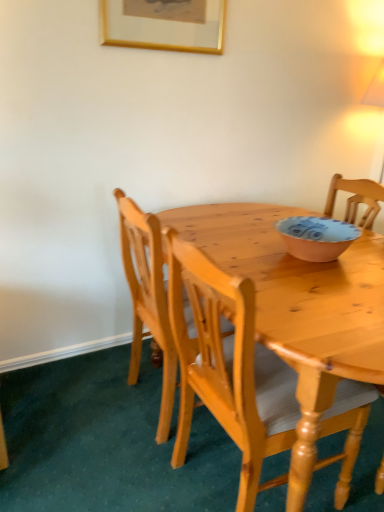
Question: Should I look upward or downward to see matte pink bowl at center?

Choices:
 (A) down
 (B) up

Answer: (B)

Question: Is matte pink bowl at center a part of gold-framed picture at upper center?

Choices:
 (A) no
 (B) yes

Answer: (A)

Question: Is gold-framed picture at upper center next to matte pink bowl at center?

Choices:
 (A) no
 (B) yes

Answer: (A)

Question: Is gold-framed picture at upper center thinner than matte pink bowl at center?

Choices:
 (A) yes
 (B) no

Answer: (A)

Question: From the image's perspective, is gold-framed picture at upper center below matte pink bowl at center?

Choices:
 (A) yes
 (B) no

Answer: (B)

Question: Is gold-framed picture at upper center facing towards matte pink bowl at center?

Choices:
 (A) yes
 (B) no

Answer: (B)

Question: Is gold-framed picture at upper center further to the viewer compared to matte pink bowl at center?

Choices:
 (A) yes
 (B) no

Answer: (A)

Question: Is matte pink bowl at center behind light brown wooden chair at center, acting as the 1th chair starting from the back?

Choices:
 (A) yes
 (B) no

Answer: (A)

Question: Is matte pink bowl at center positioned in front of light brown wooden chair at center, the second chair when ordered from front to back?

Choices:
 (A) yes
 (B) no

Answer: (B)

Question: From a real-world perspective, is matte pink bowl at center physically above light brown wooden chair at center, the second chair when ordered from front to back?

Choices:
 (A) yes
 (B) no

Answer: (A)

Question: Is matte pink bowl at center smaller than light brown wooden chair at center, the second chair when ordered from front to back?

Choices:
 (A) yes
 (B) no

Answer: (A)

Question: Would you say matte pink bowl at center is a long distance from light brown wooden chair at center, acting as the 1th chair starting from the back?

Choices:
 (A) yes
 (B) no

Answer: (B)

Question: Are matte pink bowl at center and light brown wooden chair at center, the second chair when ordered from front to back, making contact?

Choices:
 (A) no
 (B) yes

Answer: (A)

Question: Is gold-framed picture at upper center at the left side of light brown wooden chair at center, acting as the 2th chair starting from the back?

Choices:
 (A) no
 (B) yes

Answer: (B)